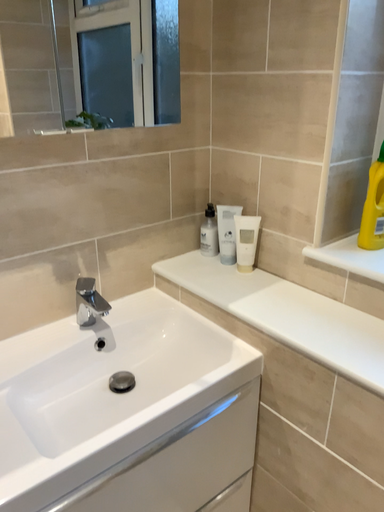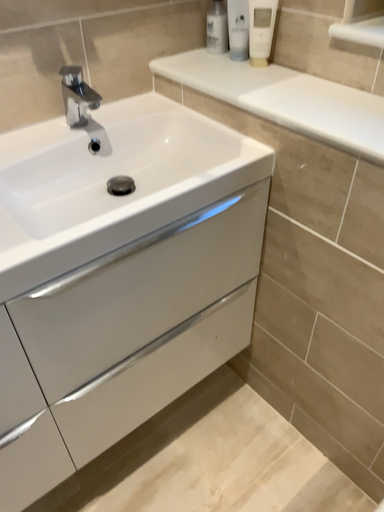
Question: How did the camera likely rotate when shooting the video?

Choices:
 (A) rotated upward
 (B) rotated downward

Answer: (B)